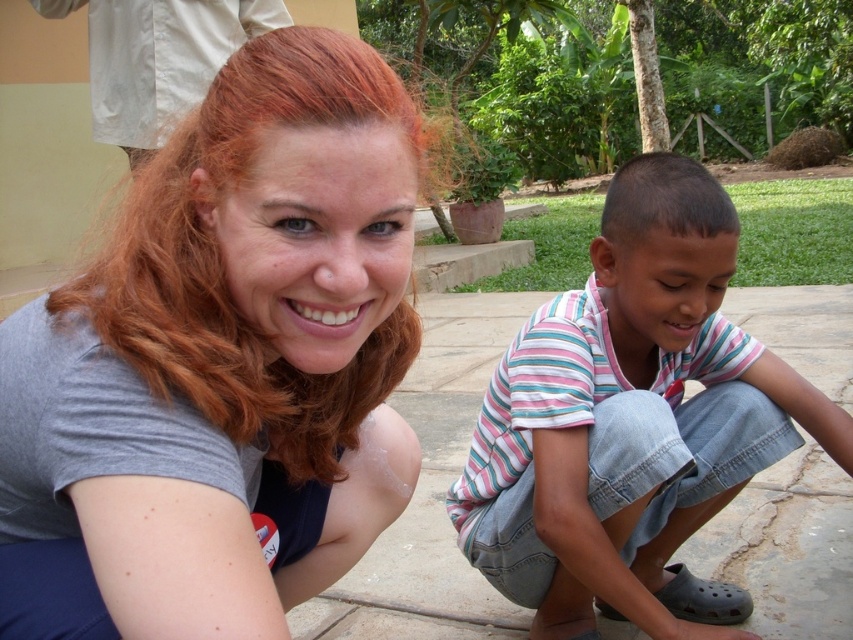
You are a photographer standing 2 meters away from the gray matte shirt at upper left and the white fabric at upper left. Can you fit both objects in your camera frame without moving? Explain your reasoning.

The gray matte shirt at upper left and white fabric at upper left are 1.97 meters apart from each other. Since you are standing 2 meters away from both objects, the distance between them is less than your distance from them, so they can both fit within the camera frame without moving.

You are a fashion designer observing the two shirts in the image. The gray matte shirt at upper left and the striped cotton shirt at lower right. Which one has a shorter length?

The gray matte shirt at upper left is shorter than the striped cotton shirt at lower right.